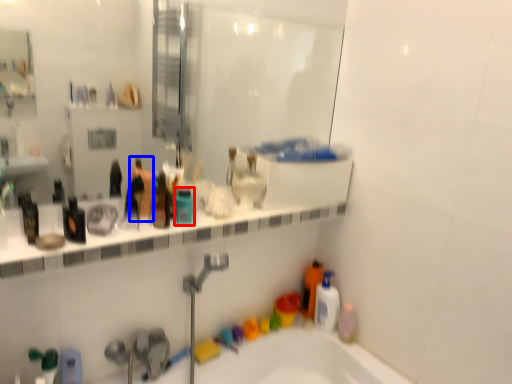
Question: Which object appears closest to the camera in this image, mouthwash (highlighted by a red box) or toiletry (highlighted by a blue box)?

Choices:
 (A) mouthwash
 (B) toiletry

Answer: (B)